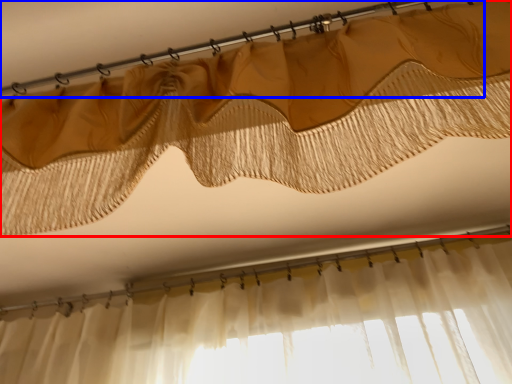
Question: Which object appears closest to the camera in this image, curtain (highlighted by a red box) or clothesline (highlighted by a blue box)?

Choices:
 (A) curtain
 (B) clothesline

Answer: (A)